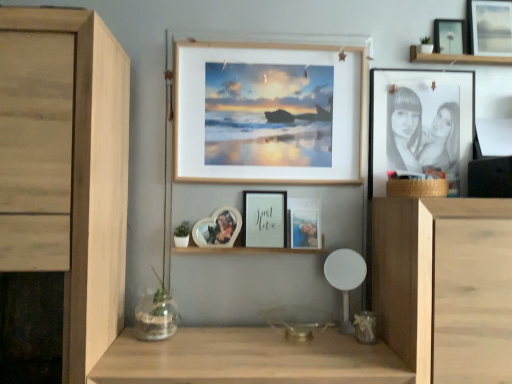
This screenshot has width=512, height=384. Find the location of `empty space that is ontop of white glossy photo frame at center (from a real-world perspective)`. empty space that is ontop of white glossy photo frame at center (from a real-world perspective) is located at coordinates (247, 243).